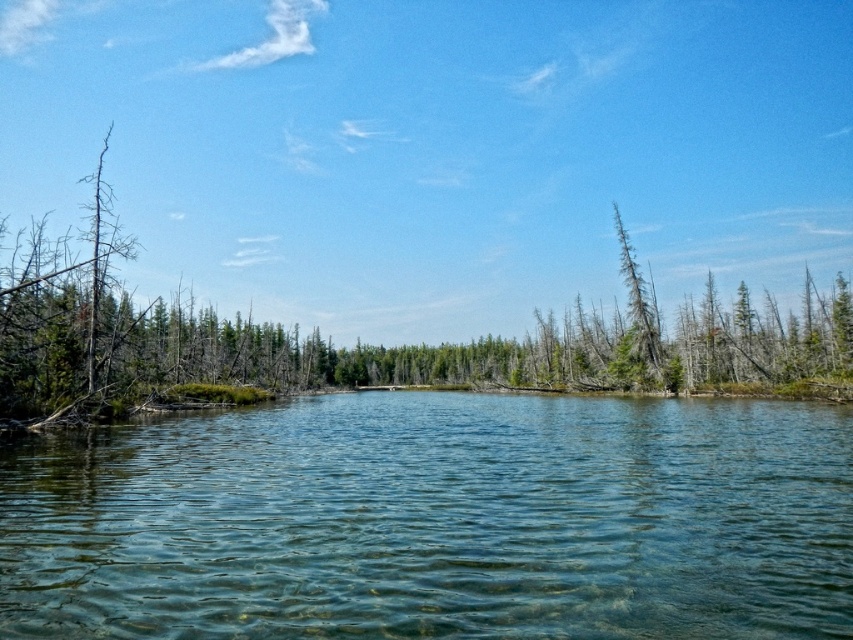
Question: Can you confirm if clear water at center is bigger than green textured tree at center-right?

Choices:
 (A) yes
 (B) no

Answer: (B)

Question: Which object appears farthest from the camera in this image?

Choices:
 (A) clear water at center
 (B) green textured tree at center-right
 (C) green matte tree at center

Answer: (B)

Question: Does clear water at center come in front of green textured tree at center-right?

Choices:
 (A) no
 (B) yes

Answer: (B)

Question: Can you confirm if green matte tree at center is bigger than green textured tree at center-right?

Choices:
 (A) yes
 (B) no

Answer: (A)

Question: Considering the real-world distances, which object is farthest from the green matte tree at center?

Choices:
 (A) clear water at center
 (B) green textured tree at center-right

Answer: (B)

Question: Among these objects, which one is nearest to the camera?

Choices:
 (A) green textured tree at center-right
 (B) clear water at center

Answer: (B)